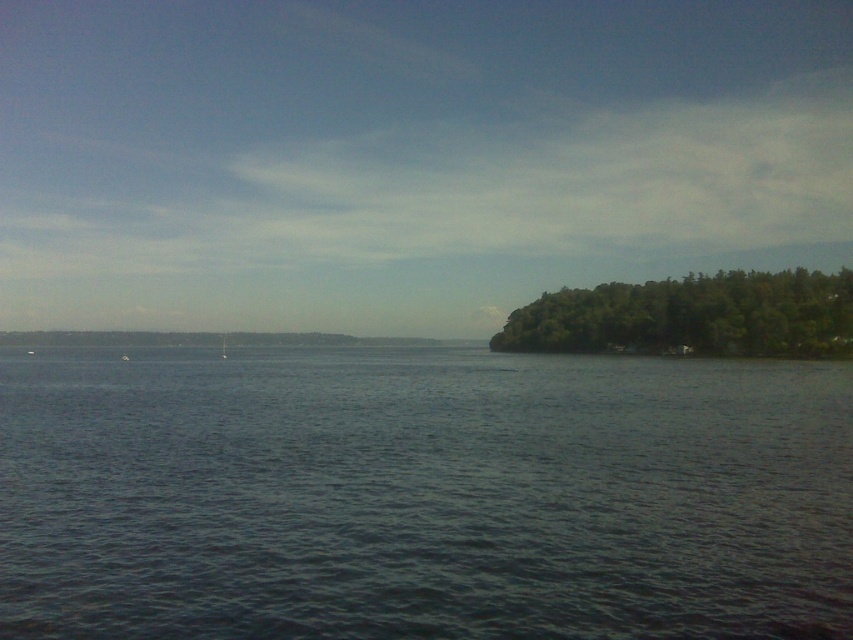
Question: Where is dark blue water at center located in relation to white matte boat at center in the image?

Choices:
 (A) below
 (B) above

Answer: (B)

Question: Which object is positioned farthest from the green leafy trees at right?

Choices:
 (A) dark blue water at center
 (B) white matte boat at center

Answer: (B)

Question: Is dark blue water at center bigger than green leafy trees at right?

Choices:
 (A) yes
 (B) no

Answer: (B)

Question: Among these points, which one is nearest to the camera?

Choices:
 (A) (125, 358)
 (B) (86, 401)

Answer: (B)

Question: Does dark blue water at center appear on the right side of white matte boat at center?

Choices:
 (A) no
 (B) yes

Answer: (B)

Question: Which object appears closest to the camera in this image?

Choices:
 (A) green leafy trees at right
 (B) white matte boat at center
 (C) dark blue water at center

Answer: (C)